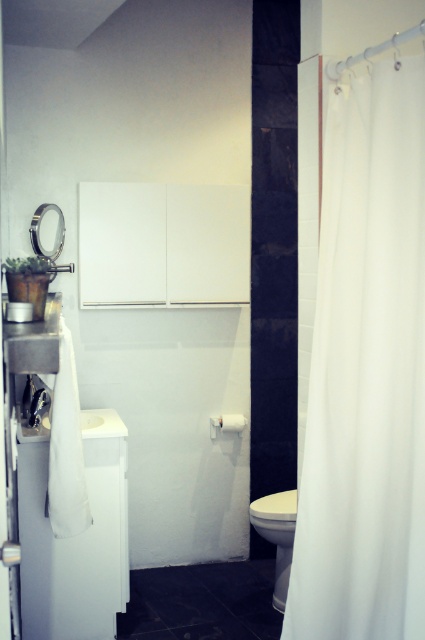
Question: Among these objects, which one is nearest to the camera?

Choices:
 (A) white glossy toilet bowl at lower center
 (B) white fabric shower curtain at right

Answer: (B)

Question: Among these objects, which one is farthest from the camera?

Choices:
 (A) white fabric shower curtain at right
 (B) white glossy toilet bowl at lower center

Answer: (B)

Question: Does white fabric shower curtain at right appear over white glossy toilet bowl at lower center?

Choices:
 (A) no
 (B) yes

Answer: (B)

Question: Does white fabric shower curtain at right have a smaller size compared to white glossy toilet bowl at lower center?

Choices:
 (A) no
 (B) yes

Answer: (A)

Question: Does white fabric shower curtain at right lie in front of white glossy toilet bowl at lower center?

Choices:
 (A) no
 (B) yes

Answer: (B)